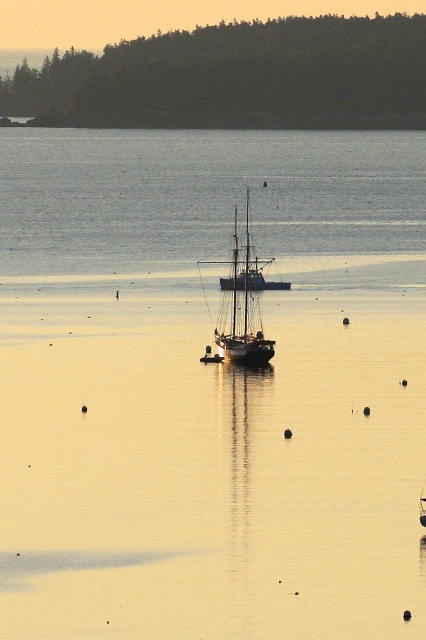
Is clear water at center behind wooden sailboat at center?

That is True.

Is clear water at center to the right of wooden sailboat at center from the viewer's perspective?

Indeed, clear water at center is positioned on the right side of wooden sailboat at center.

Between point (275, 132) and point (247, 244), which one is positioned in front?

Positioned in front is point (247, 244).

Find the location of a particular element. clear water at center is located at coordinates (203, 196).